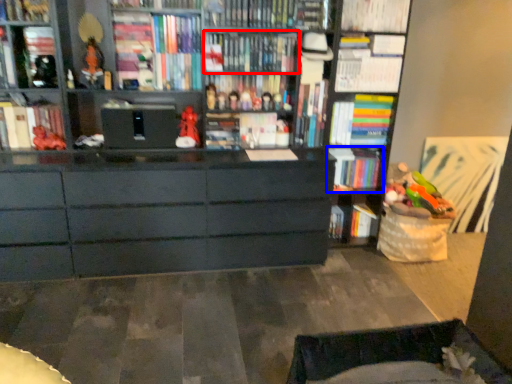
Question: Which object appears farthest to the camera in this image, book (highlighted by a red box) or book (highlighted by a blue box)?

Choices:
 (A) book
 (B) book

Answer: (B)